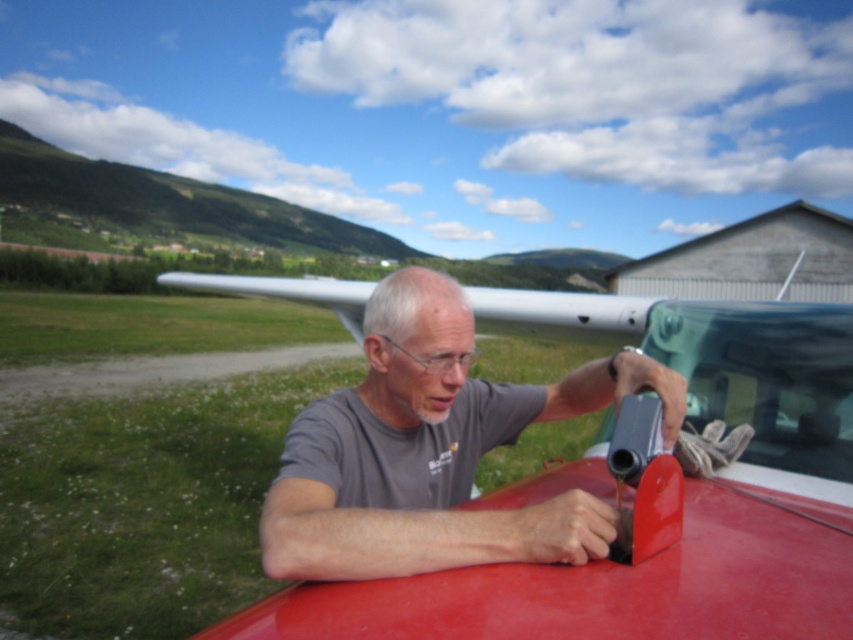
Question: Is gray matte shirt at center bigger than transparent glass windshield at center?

Choices:
 (A) no
 (B) yes

Answer: (B)

Question: Which of the following is the farthest from the observer?

Choices:
 (A) (578, 394)
 (B) (837, 429)

Answer: (A)

Question: Among these objects, which one is nearest to the camera?

Choices:
 (A) transparent glass windshield at center
 (B) gray matte shirt at center

Answer: (B)

Question: Can you confirm if gray matte shirt at center is positioned above transparent glass windshield at center?

Choices:
 (A) yes
 (B) no

Answer: (B)

Question: Which point is farther to the camera?

Choices:
 (A) transparent glass windshield at center
 (B) gray matte shirt at center

Answer: (A)

Question: Does gray matte shirt at center appear on the right side of transparent glass windshield at center?

Choices:
 (A) yes
 (B) no

Answer: (B)